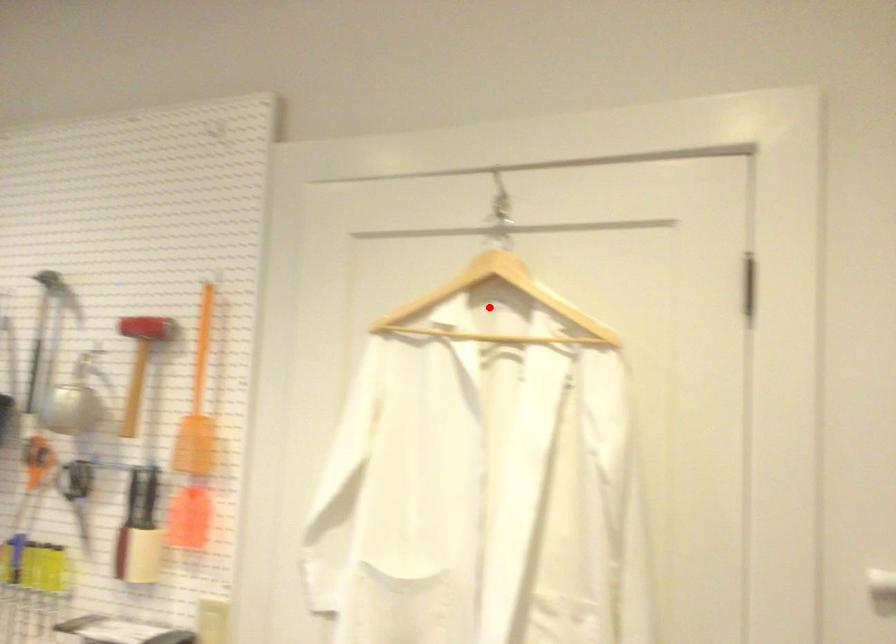
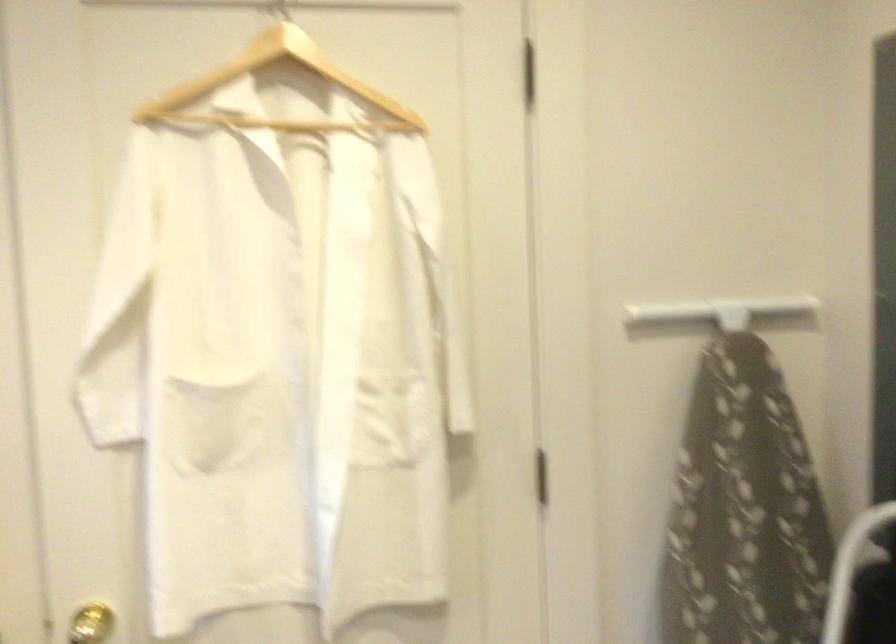
Locate, in the second image, the point that corresponds to the highlighted location in the first image.

(277, 90)